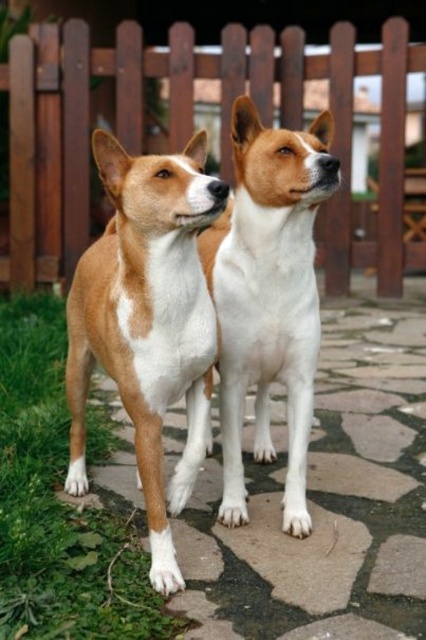
Is white fur dog at center behind green grass at lower left?

Yes, white fur dog at center is further from the viewer.

Which is above, white fur dog at center or green grass at lower left?

white fur dog at center is higher up.

You are a GUI agent. You are given a task and a screenshot of the screen. Output one action in this format:
    pyautogui.click(x=<x>, y=<y>)
    Task: Click on the white fur dog at center
    
    Given the screenshot: What is the action you would take?
    pyautogui.click(x=268, y=296)

Which is more to the right, brown stone pavement at center or white fur dog at center?

From the viewer's perspective, white fur dog at center appears more on the right side.

Identify the location of brown stone pavement at center. (327, 496).

The height and width of the screenshot is (640, 426). In order to click on brown stone pavement at center in this screenshot , I will do `click(327, 496)`.

Does wooden fence at upper center appear over white fur dog at center?

Yes, wooden fence at upper center is above white fur dog at center.

Can you confirm if wooden fence at upper center is bigger than white fur dog at center?

Correct, wooden fence at upper center is larger in size than white fur dog at center.

Is point (347, 195) positioned behind point (296, 445)?

That is True.

You are a GUI agent. You are given a task and a screenshot of the screen. Output one action in this format:
    pyautogui.click(x=<x>, y=<y>)
    Task: Click on the wooden fence at upper center
    The image size is (426, 640).
    Given the screenshot: What is the action you would take?
    [190, 131]